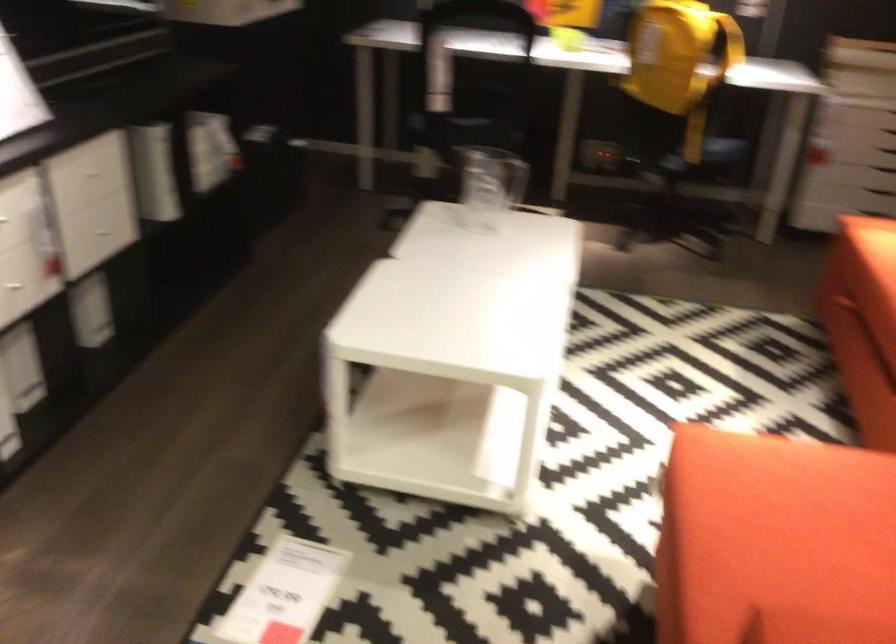
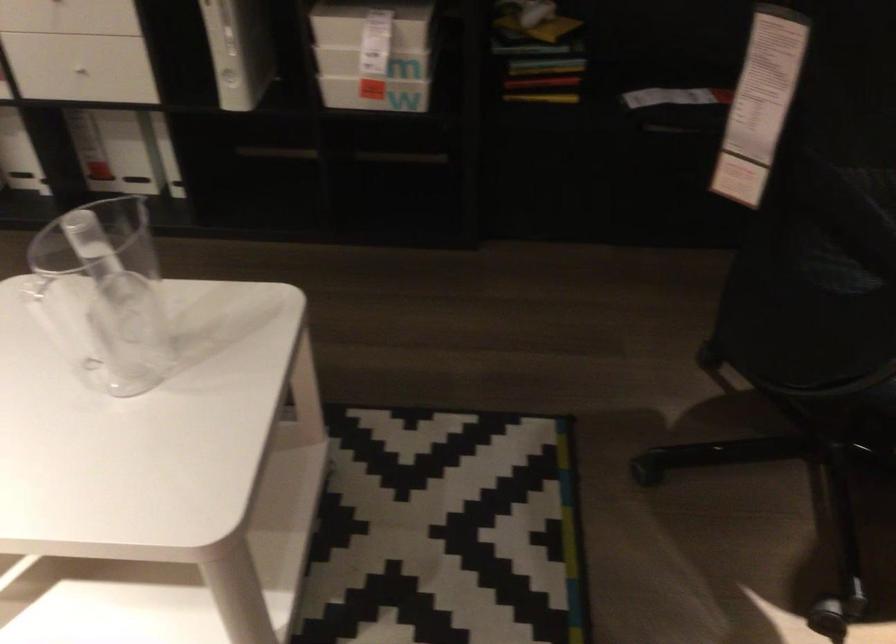
Question: I am providing you with two images of the same scene from different viewpoints. Please identify which objects are invisible in image2.

Choices:
 (A) clear plastic scoop
 (B) clear pitcher handle
 (C) chair sitting surface
 (D) none of these

Answer: (D)